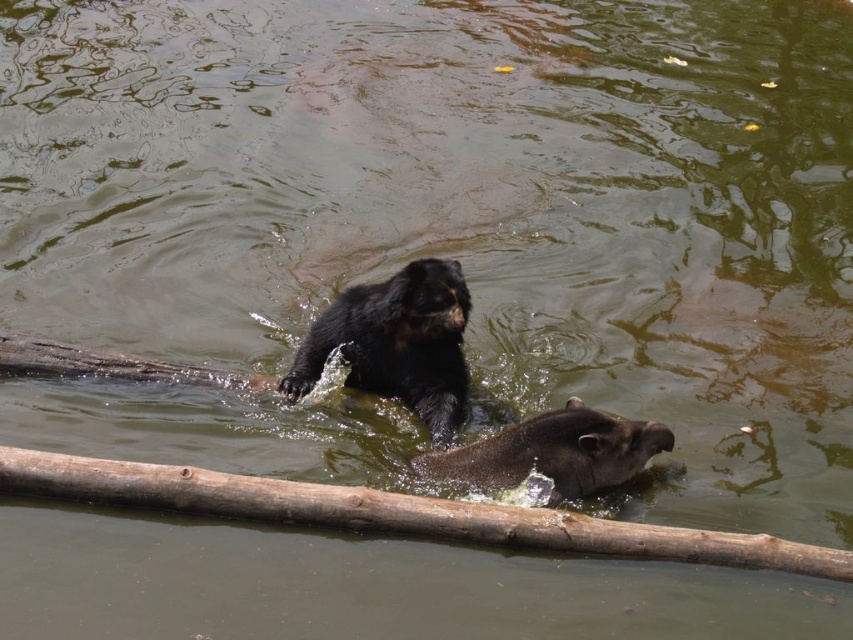
You are a photographer trying to capture the bear in the water. You notice a point marked at coordinates (396,513). What object is located at this point?

The point at coordinates (396,513) marks the location of the brown rough wood at center.

You are standing 20 feet away from a brown rough wood at center in a murky greenish water scene. Can you reach it without moving closer?

The brown rough wood at center is 19.18 feet away from you, so yes, you can reach it without moving closer since you are already within the 20 feet distance.

You are observing a natural scene with a black furry bear at upper center and a log partially submerged in the water. Which object is closer to the center of the image?

The black furry bear at upper center is located at point (396, 342), which is closer to the center of the image compared to the log partially submerged in the water.